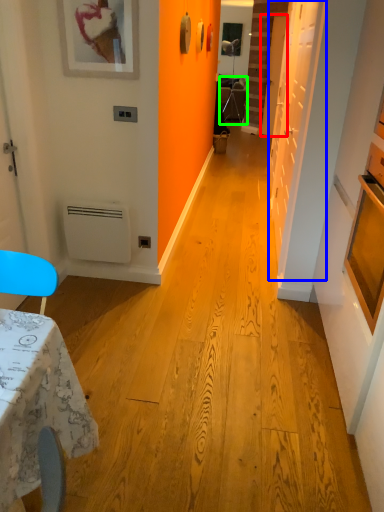
Question: Which is farther away from door (highlighted by a red box)? door (highlighted by a blue box) or armchair (highlighted by a green box)?

Choices:
 (A) door
 (B) armchair

Answer: (A)